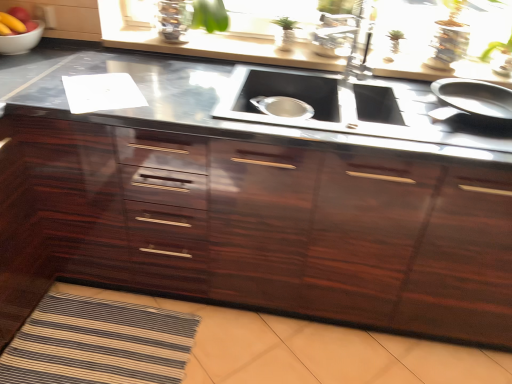
Question: Is black stainless steel sink at center far from white glossy bowl at upper left?

Choices:
 (A) yes
 (B) no

Answer: (A)

Question: Is black stainless steel sink at center directly adjacent to white glossy bowl at upper left?

Choices:
 (A) yes
 (B) no

Answer: (B)

Question: Considering the relative sizes of black stainless steel sink at center and white glossy bowl at upper left in the image provided, is black stainless steel sink at center shorter than white glossy bowl at upper left?

Choices:
 (A) yes
 (B) no

Answer: (B)

Question: From a real-world perspective, does black stainless steel sink at center stand above white glossy bowl at upper left?

Choices:
 (A) yes
 (B) no

Answer: (B)

Question: Is black stainless steel sink at center facing towards white glossy bowl at upper left?

Choices:
 (A) no
 (B) yes

Answer: (A)

Question: Is black stainless steel sink at center to the left or to the right of white glossy bowl at upper left in the image?

Choices:
 (A) left
 (B) right

Answer: (B)

Question: Is black stainless steel sink at center inside or outside of white glossy bowl at upper left?

Choices:
 (A) outside
 (B) inside

Answer: (A)

Question: In terms of size, does black stainless steel sink at center appear bigger or smaller than white glossy bowl at upper left?

Choices:
 (A) small
 (B) big

Answer: (B)

Question: In the image, is black stainless steel sink at center positioned in front of or behind white glossy bowl at upper left?

Choices:
 (A) front
 (B) behind

Answer: (A)

Question: Does point (152, 289) appear closer or farther from the camera than point (357, 132)?

Choices:
 (A) closer
 (B) farther

Answer: (B)

Question: Visually, is glossy wood cabinetry at center positioned to the left or to the right of black stainless steel sink at center?

Choices:
 (A) right
 (B) left

Answer: (B)

Question: From the image's perspective, relative to black stainless steel sink at center, is glossy wood cabinetry at center above or below?

Choices:
 (A) above
 (B) below

Answer: (B)

Question: Is glossy wood cabinetry at center bigger or smaller than black stainless steel sink at center?

Choices:
 (A) small
 (B) big

Answer: (B)

Question: Based on their positions, is smooth red apple at upper left located to the left or right of glossy wood cabinetry at center?

Choices:
 (A) left
 (B) right

Answer: (A)

Question: Is smooth red apple at upper left inside the boundaries of glossy wood cabinetry at center, or outside?

Choices:
 (A) outside
 (B) inside

Answer: (A)